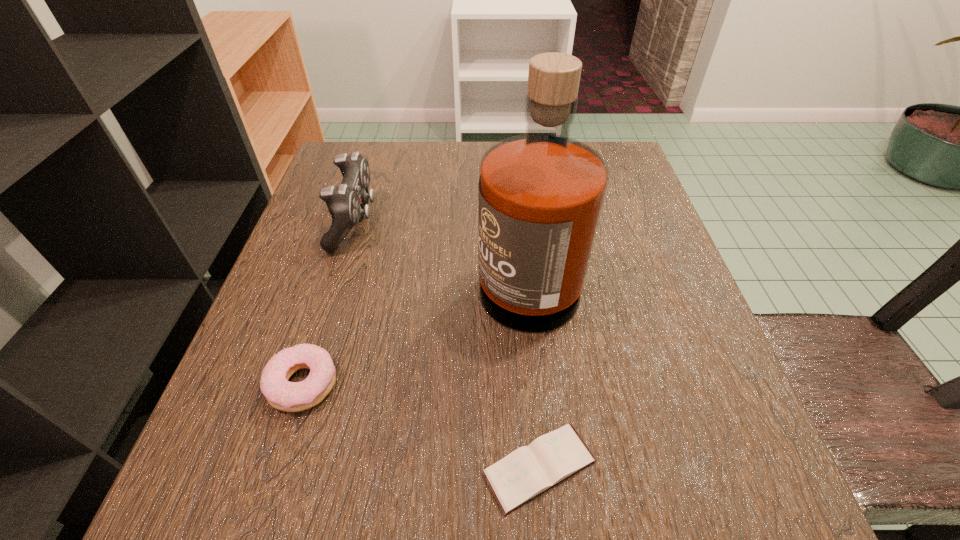
Locate an element on the screen. vacant area situated 0.090m on the right of the second nearest object is located at coordinates (399, 384).

This screenshot has width=960, height=540. I want to click on free location located 0.180m on the back of the shortest object, so click(x=526, y=321).

You are a GUI agent. You are given a task and a screenshot of the screen. Output one action in this format:
    pyautogui.click(x=<x>, y=<y>)
    Task: Click on the object present at the far edge
    This screenshot has width=960, height=540.
    Given the screenshot: What is the action you would take?
    pyautogui.click(x=346, y=202)

The image size is (960, 540). Identify the location of object situated at the near edge. (527, 472).

The height and width of the screenshot is (540, 960). Identify the location of control that is at the left edge. (346, 202).

The width and height of the screenshot is (960, 540). What are the coordinates of `doughnut that is at the left edge` in the screenshot? It's located at (281, 394).

Where is `object that is at the far left corner`? object that is at the far left corner is located at coordinates (346, 202).

Find the location of `vacant space at the far edge of the desktop`. vacant space at the far edge of the desktop is located at coordinates (476, 170).

You are a GUI agent. You are given a task and a screenshot of the screen. Output one action in this format:
    pyautogui.click(x=<x>, y=<y>)
    Task: Click on the vacant space at the near edge of the desktop
    Image resolution: width=960 pixels, height=540 pixels.
    Given the screenshot: What is the action you would take?
    pyautogui.click(x=327, y=457)

In the image, there is a desktop. Where is `vacant area at the left edge`? vacant area at the left edge is located at coordinates (368, 224).